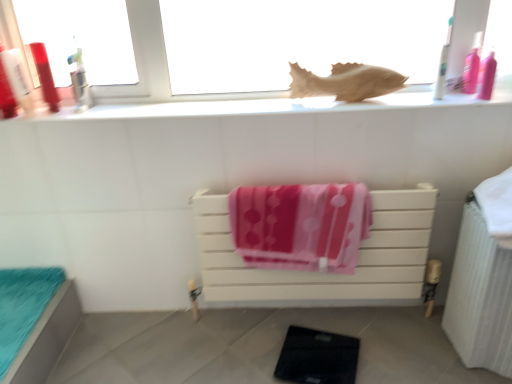
Find the location of a particular element. The width and height of the screenshot is (512, 384). free spot to the left of white wooden towel rack at center, the first furniture positioned from the right is located at coordinates (185, 341).